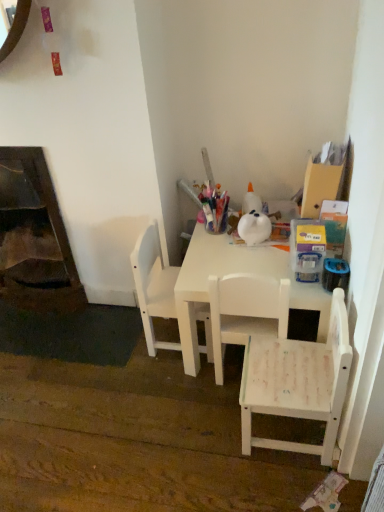
Question: Is white matte chair at center, acting as the 3th chair starting from the right, taller than dark brown wood fireplace at lower left?

Choices:
 (A) no
 (B) yes

Answer: (A)

Question: Considering the relative sizes of white matte chair at center, acting as the 3th chair starting from the right, and dark brown wood fireplace at lower left in the image provided, is white matte chair at center, acting as the 3th chair starting from the right, thinner than dark brown wood fireplace at lower left?

Choices:
 (A) no
 (B) yes

Answer: (A)

Question: Is dark brown wood fireplace at lower left located within white matte chair at center, positioned as the 1th chair in left-to-right order?

Choices:
 (A) no
 (B) yes

Answer: (A)

Question: Is white matte chair at center, acting as the 3th chair starting from the right, with dark brown wood fireplace at lower left?

Choices:
 (A) no
 (B) yes

Answer: (A)

Question: Considering the relative sizes of white matte chair at center, positioned as the 1th chair in left-to-right order, and dark brown wood fireplace at lower left in the image provided, is white matte chair at center, positioned as the 1th chair in left-to-right order, smaller than dark brown wood fireplace at lower left?

Choices:
 (A) yes
 (B) no

Answer: (A)

Question: Based on their positions, is white matte chair at lower right, the 1th chair viewed from the right, located to the left or right of white matte table at center?

Choices:
 (A) right
 (B) left

Answer: (A)

Question: From the image's perspective, is white matte chair at lower right, the 1th chair viewed from the right, above or below white matte table at center?

Choices:
 (A) above
 (B) below

Answer: (B)

Question: Is white matte chair at lower right, the 1th chair viewed from the right, wider or thinner than white matte table at center?

Choices:
 (A) thin
 (B) wide

Answer: (A)

Question: Is white matte chair at lower right, the 1th chair viewed from the right, in front of or behind white matte table at center in the image?

Choices:
 (A) behind
 (B) front

Answer: (B)

Question: Considering the positions of white matte table at center and white matte chair at center, acting as the second chair starting from the right, in the image, is white matte table at center bigger or smaller than white matte chair at center, acting as the second chair starting from the right,?

Choices:
 (A) big
 (B) small

Answer: (A)

Question: Is point (182, 324) closer or farther from the camera than point (269, 314)?

Choices:
 (A) farther
 (B) closer

Answer: (A)

Question: Considering the positions of white matte table at center and white matte chair at center, the 2th chair when ordered from left to right, in the image, is white matte table at center taller or shorter than white matte chair at center, the 2th chair when ordered from left to right,?

Choices:
 (A) tall
 (B) short

Answer: (B)

Question: Relative to white matte chair at center, acting as the second chair starting from the right, is white matte table at center in front or behind?

Choices:
 (A) behind
 (B) front

Answer: (A)

Question: From their relative heights in the image, would you say white matte chair at center, the 2th chair when ordered from left to right, is taller or shorter than white matte table at center?

Choices:
 (A) tall
 (B) short

Answer: (A)

Question: From the image's perspective, relative to white matte table at center, is white matte chair at center, acting as the second chair starting from the right, above or below?

Choices:
 (A) above
 (B) below

Answer: (B)